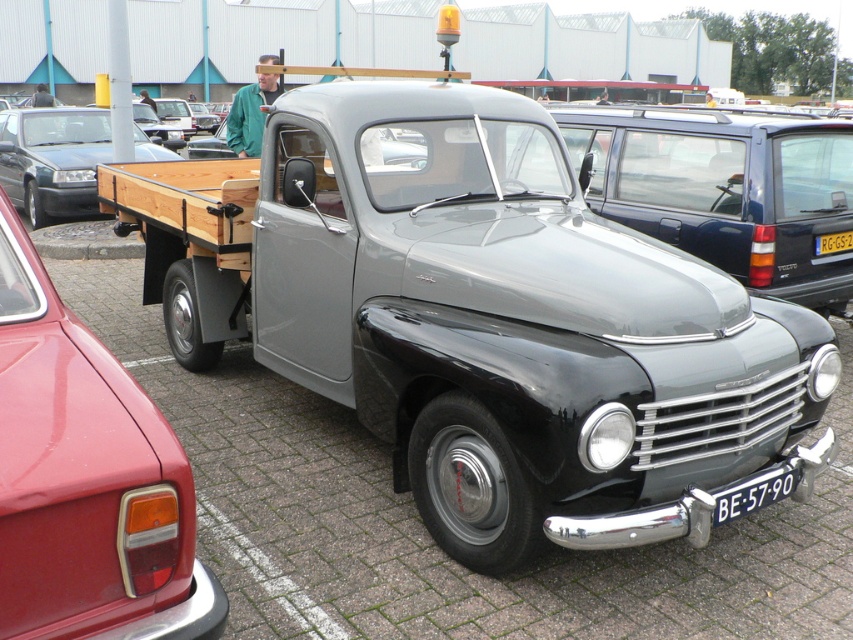
Who is higher up, white plastic license plate at lower center or yellow plastic license plate at center?

Positioned higher is yellow plastic license plate at center.

Can you confirm if white plastic license plate at lower center is positioned above yellow plastic license plate at center?

No, white plastic license plate at lower center is not above yellow plastic license plate at center.

Between point (798, 483) and point (849, 234), which one is positioned in front?

Point (798, 483) is more forward.

This screenshot has width=853, height=640. Identify the location of white plastic license plate at lower center. (753, 493).

Is matte gray truck at center taller than green leather jacket at upper center?

Incorrect, matte gray truck at center's height is not larger of green leather jacket at upper center's.

Which is behind, point (523, 552) or point (236, 122)?

Point (236, 122)

Where is `matte gray truck at center`? The width and height of the screenshot is (853, 640). matte gray truck at center is located at coordinates (480, 317).

Between point (461, 561) and point (828, 244), which one is positioned behind?

Positioned behind is point (828, 244).

Does matte gray truck at center have a larger size compared to yellow plastic license plate at center?

Yes.

Is point (300, 164) behind point (846, 250)?

That is False.

Find the location of a particular element. The width and height of the screenshot is (853, 640). matte gray truck at center is located at coordinates (480, 317).